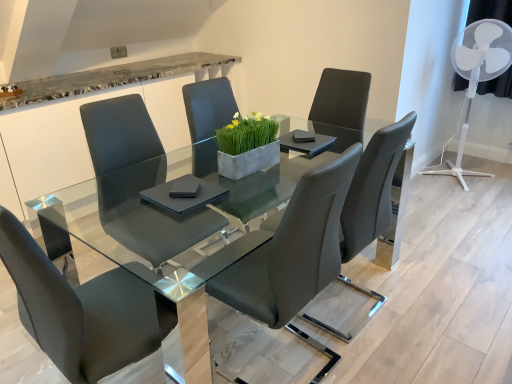
Find the location of a particular element. The image size is (512, 384). white plastic fan at upper right is located at coordinates (477, 74).

In the scene shown: What is the approximate width of transparent glass table at center?

35.97 inches.

The image size is (512, 384). I want to click on matte black chair at center, the 4th chair from the right, so click(x=82, y=311).

Looking at this image, between matte black chair at center, which is the 3th chair in left-to-right order, and matte black chair at center, the 1th chair when ordered from right to left, which one has larger width?

With larger width is matte black chair at center, the 1th chair when ordered from right to left.

Is matte black chair at center, which is the 3th chair in left-to-right order, situated inside matte black chair at center, the 1th chair when ordered from right to left, or outside?

matte black chair at center, which is the 3th chair in left-to-right order, is outside matte black chair at center, the 1th chair when ordered from right to left.

Is white plastic fan at upper right touching matte black chair at center, the first chair viewed from the left?

white plastic fan at upper right is not next to matte black chair at center, the first chair viewed from the left, and they're not touching.

What's the angular difference between white plastic fan at upper right and matte black chair at center, the first chair viewed from the left,'s facing directions?

The angular difference between white plastic fan at upper right and matte black chair at center, the first chair viewed from the left, is 178 degrees.

From the image's perspective, which one is positioned lower, white plastic fan at upper right or matte black chair at center, the 4th chair from the right?

matte black chair at center, the 4th chair from the right, appears lower in the image.

Between matte black chair at center, positioned as the second chair in left-to-right order, and transparent glass table at center, which one is positioned in front?

transparent glass table at center is closer to the camera.

From a real-world perspective, which object stands above the other?

matte black chair at center, which is the 3th chair from right to left, is physically above.

In terms of width, does matte black chair at center, which is the 3th chair from right to left, look wider or thinner when compared to transparent glass table at center?

Clearly, matte black chair at center, which is the 3th chair from right to left, has less width compared to transparent glass table at center.

Does matte black chair at center, the first chair viewed from the left, lie behind white plastic fan at upper right?

No, matte black chair at center, the first chair viewed from the left, is closer to the viewer.

Which is closer to the camera, (76,308) or (482,51)?

Point (76,308)

Considering the relative sizes of matte black chair at center, the 4th chair from the right, and white plastic fan at upper right in the image provided, is matte black chair at center, the 4th chair from the right, shorter than white plastic fan at upper right?

Yes, matte black chair at center, the 4th chair from the right, is shorter than white plastic fan at upper right.

Is matte black chair at center, the first chair viewed from the left, positioned with its back to white plastic fan at upper right?

matte black chair at center, the first chair viewed from the left, is not turned away from white plastic fan at upper right.

Consider the image. From the image's perspective, is matte black chair at center, the 1th chair when ordered from right to left, on matte black chair at center, positioned as the second chair in left-to-right order?

No, from the image's perspective, matte black chair at center, the 1th chair when ordered from right to left, is not over matte black chair at center, positioned as the second chair in left-to-right order.

From the picture: Is there a large distance between matte black chair at center, the 1th chair when ordered from right to left, and matte black chair at center, positioned as the second chair in left-to-right order?

No, there isn't a large distance between matte black chair at center, the 1th chair when ordered from right to left, and matte black chair at center, positioned as the second chair in left-to-right order.

Would you say matte black chair at center, the fourth chair viewed from the left, contains matte black chair at center, positioned as the second chair in left-to-right order?

No, matte black chair at center, positioned as the second chair in left-to-right order, is not inside matte black chair at center, the fourth chair viewed from the left.

Find the location of a particular element. This screenshot has height=384, width=512. the 2nd chair below the matte black chair at center, positioned as the second chair in left-to-right order (from the image's perspective) is located at coordinates (294, 255).

Is matte black chair at center, which is the 3th chair in left-to-right order, inside the boundaries of matte black chair at center, positioned as the second chair in left-to-right order, or outside?

matte black chair at center, which is the 3th chair in left-to-right order, is outside matte black chair at center, positioned as the second chair in left-to-right order.

Does matte black chair at center, the 2th chair when ordered from right to left, touch matte black chair at center, positioned as the second chair in left-to-right order?

matte black chair at center, the 2th chair when ordered from right to left, and matte black chair at center, positioned as the second chair in left-to-right order, are clearly separated.

Which is in front, point (225, 185) or point (376, 226)?

The point (225, 185) is in front.

Looking at this image, from a real-world perspective, is matte black chair at center, which is the 3th chair from right to left, located higher than matte black chair at center, the 1th chair when ordered from right to left?

Yes, from a real-world perspective, matte black chair at center, which is the 3th chair from right to left, is above matte black chair at center, the 1th chair when ordered from right to left.

From the picture: Which object is thinner, matte black chair at center, which is the 3th chair from right to left, or matte black chair at center, the fourth chair viewed from the left?

Thinner between the two is matte black chair at center, which is the 3th chair from right to left.

Where is `chair that is the 1st one when counting forward from the matte black chair at center, the 1th chair when ordered from right to left`? chair that is the 1st one when counting forward from the matte black chair at center, the 1th chair when ordered from right to left is located at coordinates (294, 255).

The height and width of the screenshot is (384, 512). I want to click on chair that is the 1st object directly below the white plastic fan at upper right (from a real-world perspective), so click(x=82, y=311).

Estimate the real-world distances between objects in this image. Which object is further from matte black chair at center, positioned as the second chair in left-to-right order, matte black chair at center, which is the 3th chair in left-to-right order, or matte black chair at center, the 4th chair from the right?

matte black chair at center, the 4th chair from the right.

From the image, which object appears to be nearer to white plastic fan at upper right, matte black chair at center, the 1th chair when ordered from right to left, or matte black chair at center, which is the 3th chair from right to left?

matte black chair at center, the 1th chair when ordered from right to left, is closer to white plastic fan at upper right.

When comparing their distances from matte black chair at center, the 2th chair when ordered from right to left, does matte black chair at center, the fourth chair viewed from the left, or matte black chair at center, which is the 3th chair from right to left, seem closer?

matte black chair at center, the fourth chair viewed from the left.

In the scene shown: Based on their spatial positions, is white plastic fan at upper right or matte black chair at center, the 4th chair from the right, closer to matte black chair at center, which is the 3th chair in left-to-right order?

The object closer to matte black chair at center, which is the 3th chair in left-to-right order, is matte black chair at center, the 4th chair from the right.

Based on their spatial positions, is matte black chair at center, the fourth chair viewed from the left, or white plastic fan at upper right further from matte black chair at center, which is the 3th chair from right to left?

white plastic fan at upper right is further to matte black chair at center, which is the 3th chair from right to left.

Looking at the image, which one is located closer to white plastic fan at upper right, matte black chair at center, which is the 3th chair in left-to-right order, or matte black chair at center, the fourth chair viewed from the left?

matte black chair at center, the fourth chair viewed from the left, lies closer to white plastic fan at upper right than the other object.

From the image, which object appears to be nearer to matte black chair at center, the 4th chair from the right, white plastic fan at upper right or matte black chair at center, which is the 3th chair from right to left?

matte black chair at center, which is the 3th chair from right to left, is positioned closer to the anchor matte black chair at center, the 4th chair from the right.

When comparing their distances from matte black chair at center, the 2th chair when ordered from right to left, does matte black chair at center, the 4th chair from the right, or matte black chair at center, which is the 3th chair from right to left, seem closer?

matte black chair at center, the 4th chair from the right, is closer to matte black chair at center, the 2th chair when ordered from right to left.

What are the coordinates of `table located between matte black chair at center, positioned as the second chair in left-to-right order, and white plastic fan at upper right in the left-right direction` in the screenshot? It's located at (119, 240).

The image size is (512, 384). What are the coordinates of `chair between transparent glass table at center and matte black chair at center, the 1th chair when ordered from right to left, from front to back` in the screenshot? It's located at (294, 255).

The height and width of the screenshot is (384, 512). Find the location of `table between matte black chair at center, the first chair viewed from the left, and matte black chair at center, which is the 3th chair in left-to-right order`. table between matte black chair at center, the first chair viewed from the left, and matte black chair at center, which is the 3th chair in left-to-right order is located at coordinates (119, 240).

Find the location of a particular element. table between matte black chair at center, the first chair viewed from the left, and white plastic fan at upper right, in the horizontal direction is located at coordinates (119, 240).